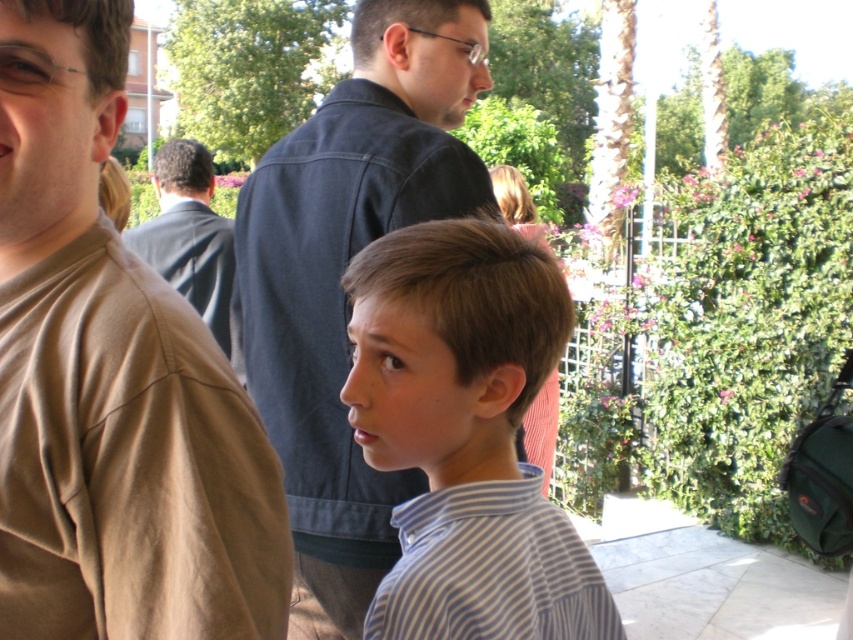
Where is `dark blue denim shirt at center`? Image resolution: width=853 pixels, height=640 pixels. dark blue denim shirt at center is located at coordinates (341, 275).

Can you confirm if dark blue denim shirt at center is positioned above dark blue shirt at center?

Yes, dark blue denim shirt at center is above dark blue shirt at center.

Which is behind, point (357, 196) or point (204, 168)?

Positioned behind is point (204, 168).

This screenshot has height=640, width=853. I want to click on dark blue denim shirt at center, so click(341, 275).

What do you see at coordinates (465, 435) in the screenshot?
I see `striped cotton shirt at center` at bounding box center [465, 435].

Does striped cotton shirt at center have a greater width compared to dark blue shirt at center?

Incorrect, striped cotton shirt at center's width does not surpass dark blue shirt at center's.

The image size is (853, 640). What are the coordinates of `striped cotton shirt at center` in the screenshot? It's located at (465, 435).

The height and width of the screenshot is (640, 853). In order to click on striped cotton shirt at center in this screenshot , I will do `click(465, 435)`.

Can you confirm if brown cotton shirt at left is thinner than dark blue shirt at center?

Indeed, brown cotton shirt at left has a lesser width compared to dark blue shirt at center.

Between brown cotton shirt at left and dark blue shirt at center, which one appears on the left side from the viewer's perspective?

From the viewer's perspective, dark blue shirt at center appears more on the left side.

This screenshot has height=640, width=853. Describe the element at coordinates (112, 381) in the screenshot. I see `brown cotton shirt at left` at that location.

This screenshot has height=640, width=853. Find the location of `brown cotton shirt at left`. brown cotton shirt at left is located at coordinates (112, 381).